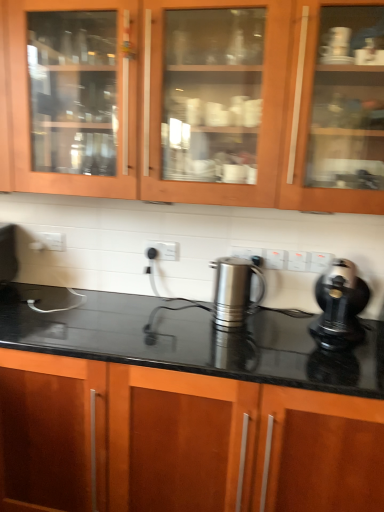
Question: Should I look upward or downward to see matte wood cabinets at upper center, arranged as the first cabinetry when viewed from the top?

Choices:
 (A) down
 (B) up

Answer: (B)

Question: Is black glossy countertop at center, arranged as the second cabinetry when viewed from the top, further to the viewer compared to polished stainless steel kettle at center?

Choices:
 (A) no
 (B) yes

Answer: (A)

Question: Considering the relative sizes of black glossy countertop at center, arranged as the second cabinetry when viewed from the top, and polished stainless steel kettle at center in the image provided, is black glossy countertop at center, arranged as the second cabinetry when viewed from the top, taller than polished stainless steel kettle at center?

Choices:
 (A) yes
 (B) no

Answer: (A)

Question: Is black glossy countertop at center, which is the first cabinetry from bottom to top, not near polished stainless steel kettle at center?

Choices:
 (A) yes
 (B) no

Answer: (B)

Question: From the image's perspective, does black glossy countertop at center, arranged as the second cabinetry when viewed from the top, appear lower than polished stainless steel kettle at center?

Choices:
 (A) no
 (B) yes

Answer: (B)

Question: Is black glossy countertop at center, arranged as the second cabinetry when viewed from the top, thinner than polished stainless steel kettle at center?

Choices:
 (A) yes
 (B) no

Answer: (B)

Question: Is black glossy countertop at center, arranged as the second cabinetry when viewed from the top, bigger than polished stainless steel kettle at center?

Choices:
 (A) no
 (B) yes

Answer: (B)

Question: Is black plastic kettle at right positioned far away from matte wood cabinets at upper center, acting as the 2th cabinetry starting from the bottom?

Choices:
 (A) yes
 (B) no

Answer: (B)

Question: From a real-world perspective, is black plastic kettle at right over matte wood cabinets at upper center, acting as the 2th cabinetry starting from the bottom?

Choices:
 (A) yes
 (B) no

Answer: (B)

Question: Can you confirm if black plastic kettle at right is wider than matte wood cabinets at upper center, arranged as the first cabinetry when viewed from the top?

Choices:
 (A) yes
 (B) no

Answer: (A)

Question: Would you say black plastic kettle at right is outside matte wood cabinets at upper center, acting as the 2th cabinetry starting from the bottom?

Choices:
 (A) yes
 (B) no

Answer: (A)

Question: Can you confirm if black plastic kettle at right is bigger than matte wood cabinets at upper center, arranged as the first cabinetry when viewed from the top?

Choices:
 (A) no
 (B) yes

Answer: (A)

Question: Does black plastic kettle at right have a greater height compared to matte wood cabinets at upper center, acting as the 2th cabinetry starting from the bottom?

Choices:
 (A) yes
 (B) no

Answer: (B)

Question: Considering the relative positions of black glossy countertop at center, arranged as the second cabinetry when viewed from the top, and black plastic kettle at right in the image provided, is black glossy countertop at center, arranged as the second cabinetry when viewed from the top, to the right of black plastic kettle at right from the viewer's perspective?

Choices:
 (A) yes
 (B) no

Answer: (B)